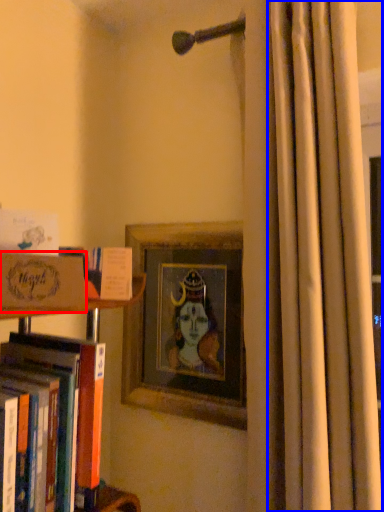
Question: Which of the following is the closest to the observer, paperback book (highlighted by a red box) or curtain (highlighted by a blue box)?

Choices:
 (A) paperback book
 (B) curtain

Answer: (A)